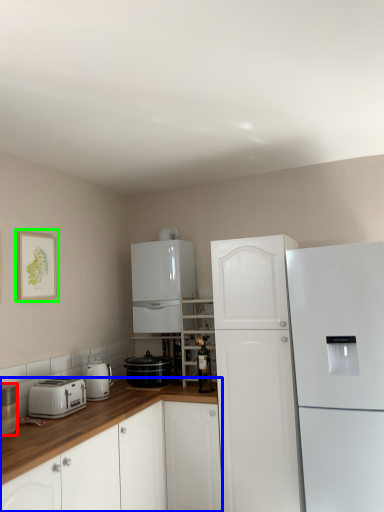
Question: Which is nearer to the home appliance (highlighted by a red box)? cabinetry (highlighted by a blue box) or picture frame (highlighted by a green box).

Choices:
 (A) cabinetry
 (B) picture frame

Answer: (A)